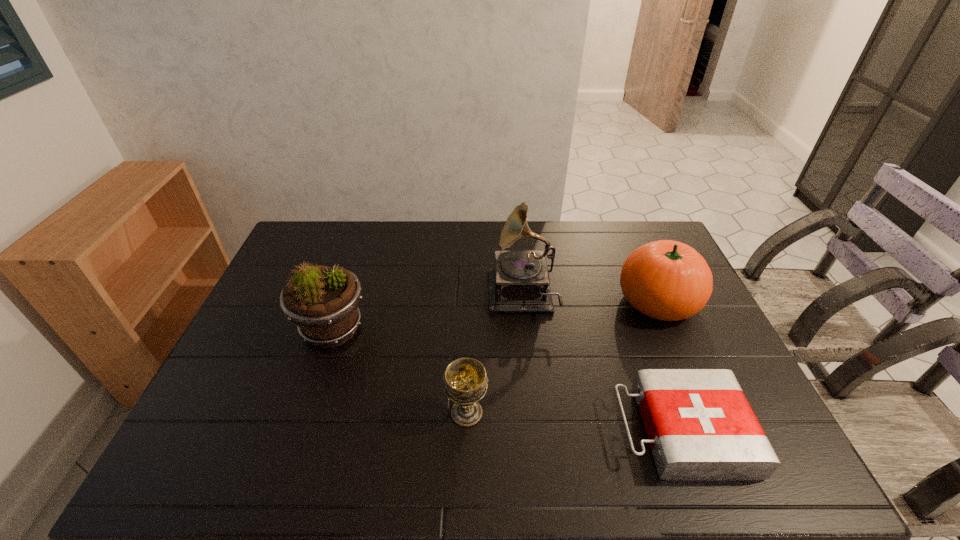
The width and height of the screenshot is (960, 540). In order to click on record player in this screenshot , I will do `click(520, 283)`.

Locate an element on the screen. the leftmost object is located at coordinates (322, 301).

Where is `the third tallest object`? This screenshot has width=960, height=540. the third tallest object is located at coordinates (668, 280).

Locate an element on the screen. Image resolution: width=960 pixels, height=540 pixels. chalice is located at coordinates pyautogui.click(x=465, y=379).

This screenshot has height=540, width=960. Find the location of `the fourth object from right to left`. the fourth object from right to left is located at coordinates click(x=465, y=379).

Locate an element on the screen. The height and width of the screenshot is (540, 960). the shortest object is located at coordinates (700, 426).

You are a GUI agent. You are given a task and a screenshot of the screen. Output one action in this format:
    pyautogui.click(x=<x>, y=<y>)
    Task: Click on the free location located on the horn of the record player
    Image resolution: width=960 pixels, height=540 pixels.
    Given the screenshot: What is the action you would take?
    pyautogui.click(x=379, y=298)

Where is `vacant space located 0.130m on the horn of the record player`? The image size is (960, 540). vacant space located 0.130m on the horn of the record player is located at coordinates (448, 298).

The height and width of the screenshot is (540, 960). I want to click on vacant space situated 0.250m on the horn of the record player, so click(410, 298).

The image size is (960, 540). I want to click on vacant space located 0.240m on the right of the leftmost object, so click(x=452, y=329).